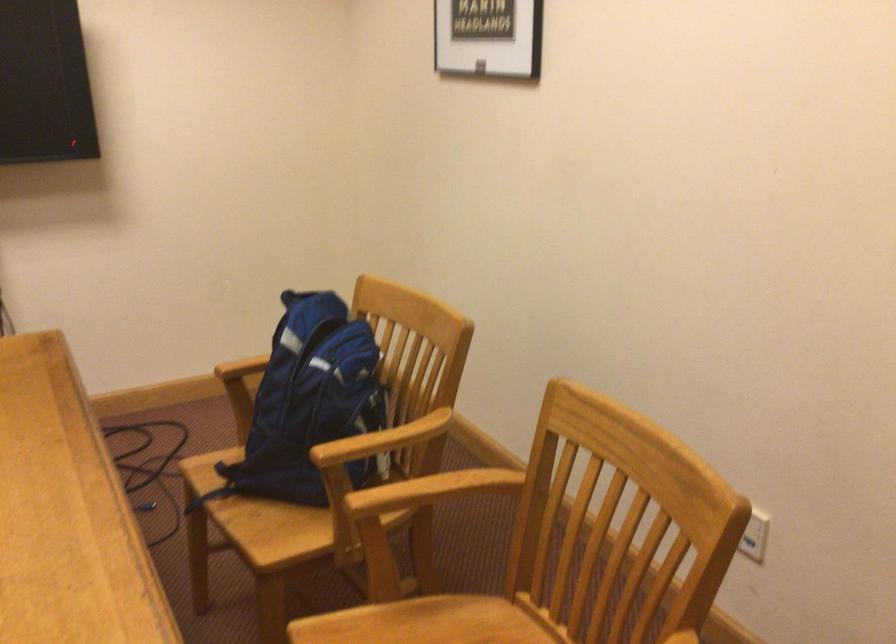
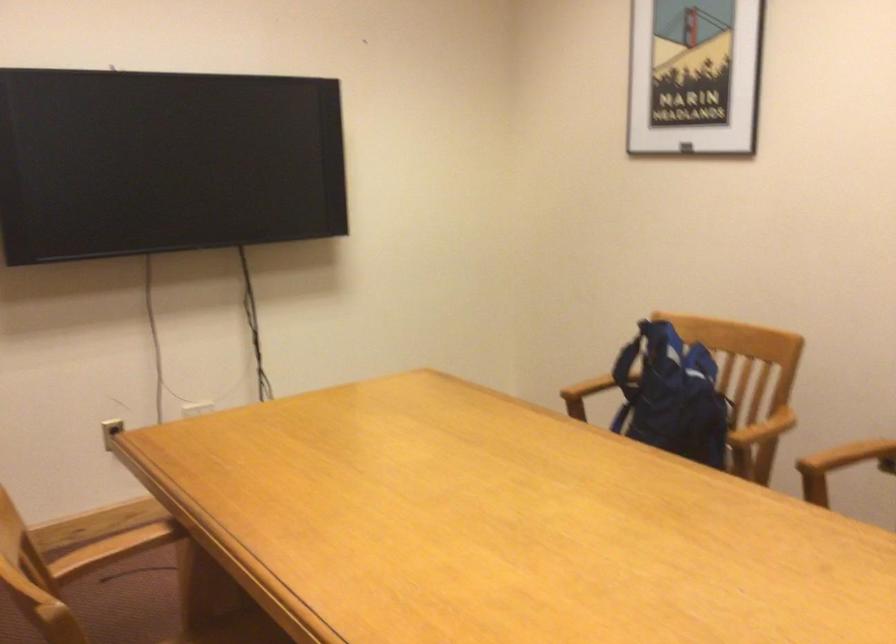
Locate, in the second image, the point that corresponds to point (453, 488) in the first image.

(849, 456)